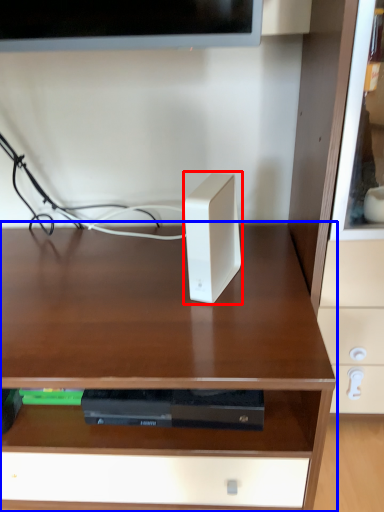
Question: Which of the following is the closest to the observer, ipod (highlighted by a red box) or desk (highlighted by a blue box)?

Choices:
 (A) ipod
 (B) desk

Answer: (B)